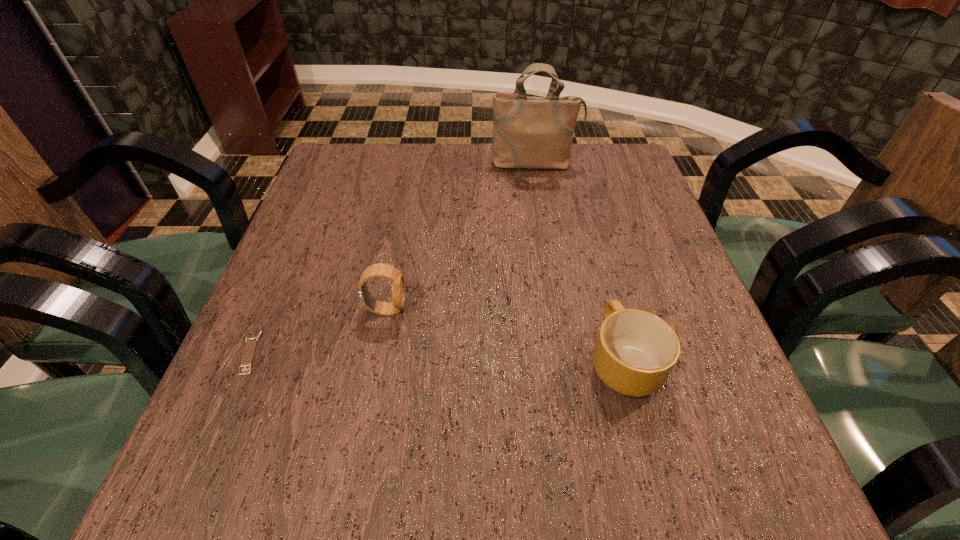
Where is `vacant space situated 0.090m on the side with the handle of the third tallest object`? vacant space situated 0.090m on the side with the handle of the third tallest object is located at coordinates (604, 289).

I want to click on vacant region located on the side with the handle of the third tallest object, so (588, 231).

In order to click on vacant space situated on the front of the nearer watch in this screenshot , I will do [x=224, y=408].

The height and width of the screenshot is (540, 960). What are the coordinates of `object located in the far edge section of the desktop` in the screenshot? It's located at (529, 132).

Locate an element on the screen. object present at the left edge is located at coordinates (252, 334).

Locate an element on the screen. This screenshot has height=540, width=960. shoulder bag that is at the right edge is located at coordinates (529, 132).

The width and height of the screenshot is (960, 540). What are the coordinates of `mug that is at the right edge` in the screenshot? It's located at (635, 352).

Locate an element on the screen. object at the far right corner is located at coordinates (529, 132).

You are a GUI agent. You are given a task and a screenshot of the screen. Output one action in this format:
    pyautogui.click(x=<x>, y=<y>)
    Task: Click on the blank area at the far edge
    Image resolution: width=960 pixels, height=540 pixels.
    Given the screenshot: What is the action you would take?
    pyautogui.click(x=441, y=172)

Identify the location of free space at the near edge of the desktop. This screenshot has height=540, width=960. (376, 453).